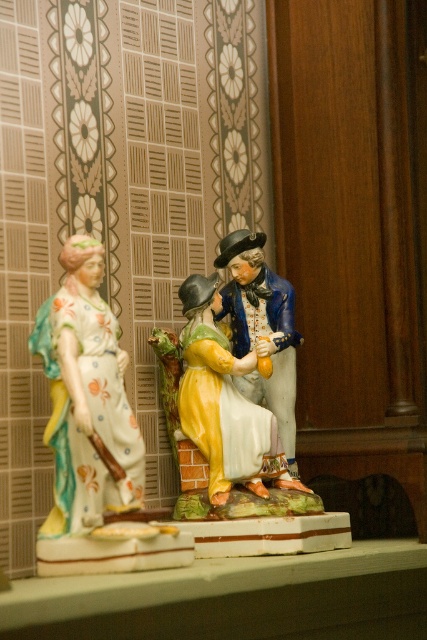
Does porcelain figurine at left have a smaller size compared to porcelain figure at center?

No.

Looking at this image, which is above, porcelain figurine at left or porcelain figure at center?

porcelain figure at center is higher up.

Identify the location of porcelain figurine at left. (85, 397).